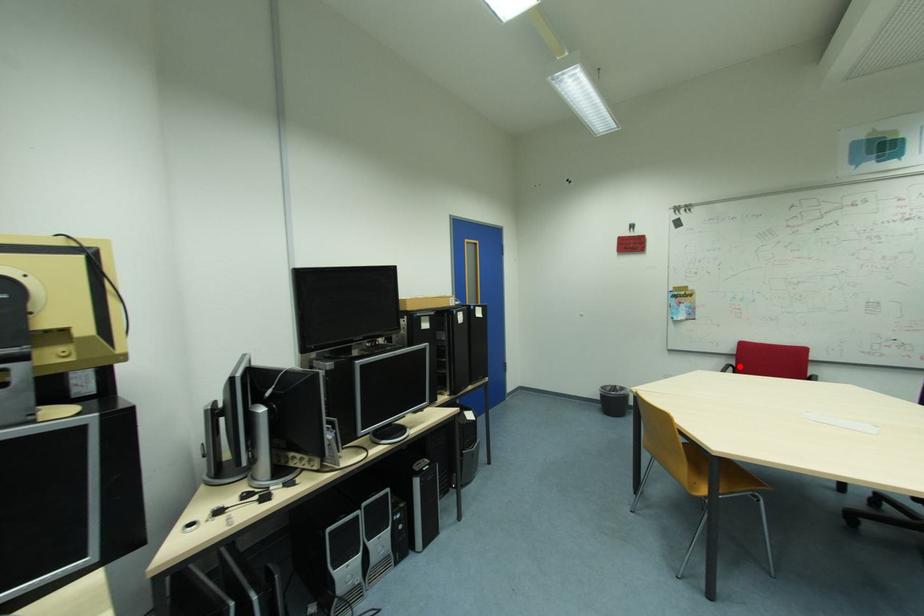
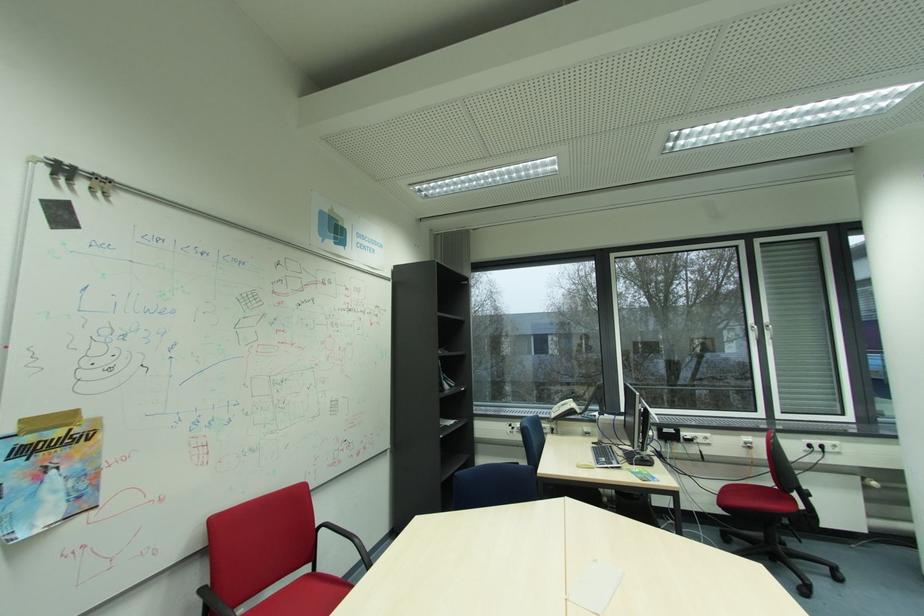
Question: I am providing you with two images of the same scene from different viewpoints. Given a red point in image1, look at the same physical point in image2. Is it:

Choices:
 (A) Closer to the viewpoint
 (B) Farther from the viewpoint

Answer: (A)